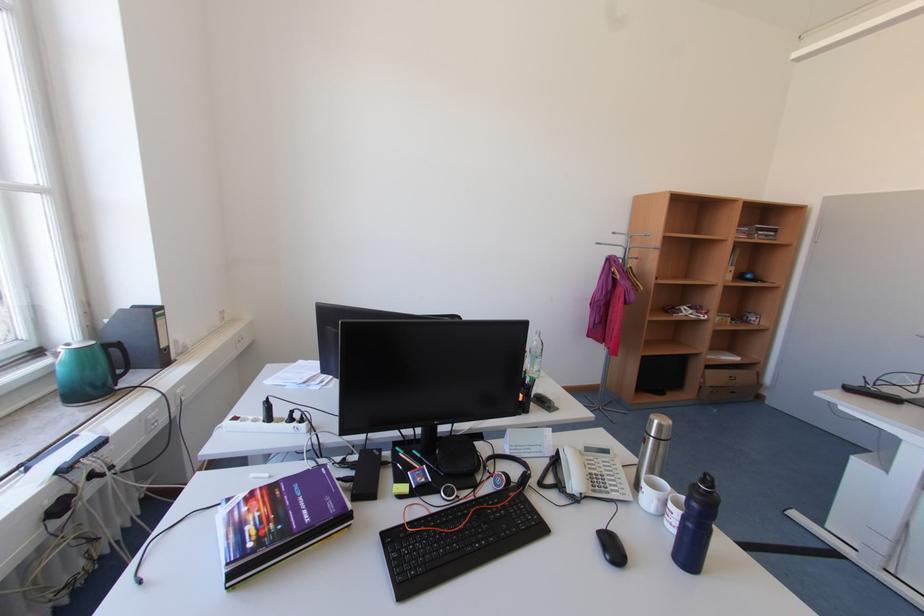
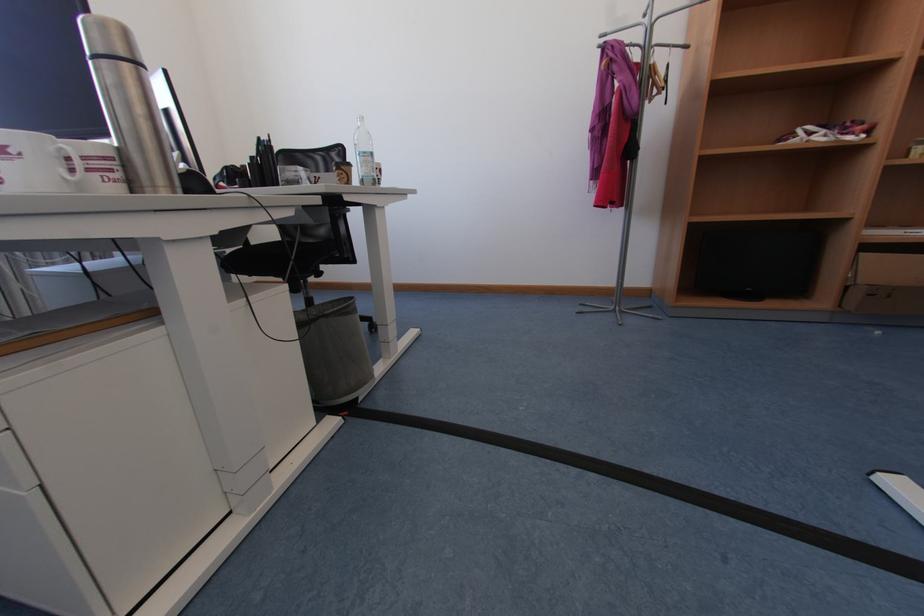
The point at (709, 389) is marked in the first image. Where is the corresponding point in the second image?

(855, 289)